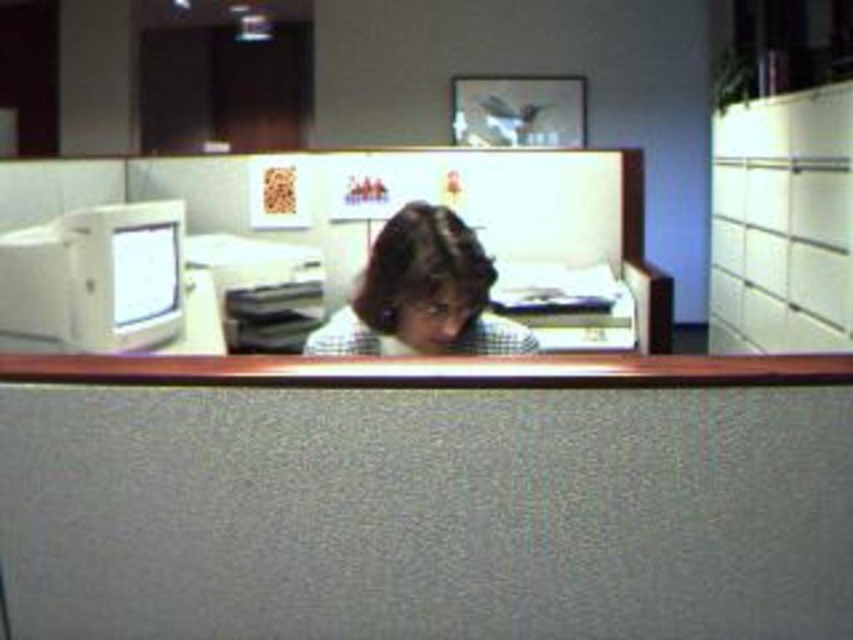
Question: Which point is closer to the camera taking this photo?

Choices:
 (A) (154, 294)
 (B) (805, 296)

Answer: (A)

Question: Can you confirm if brown fabric table at center is smaller than matte white monitor at left?

Choices:
 (A) yes
 (B) no

Answer: (A)

Question: Is brown fabric table at center above white glossy file cabinet at right?

Choices:
 (A) no
 (B) yes

Answer: (A)

Question: Is white glossy file cabinet at right closer to camera compared to brown hair at center?

Choices:
 (A) yes
 (B) no

Answer: (B)

Question: Which of the following is the closest to the observer?

Choices:
 (A) brown hair at center
 (B) white glossy monitor at left
 (C) white glossy file cabinet at right
 (D) matte white monitor at left

Answer: (A)

Question: Which point is closer to the camera?

Choices:
 (A) matte white monitor at left
 (B) white glossy file cabinet at right

Answer: (A)